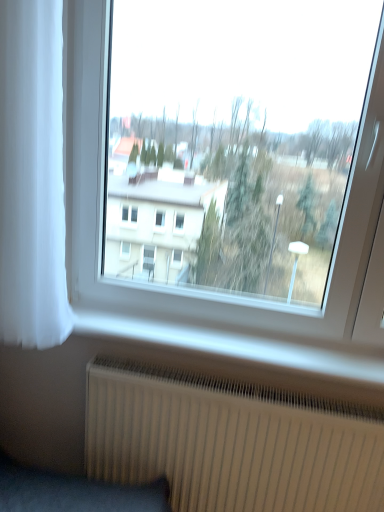
Question: Can you confirm if white sheer curtain at left is shorter than white ribbed radiator at lower center?

Choices:
 (A) no
 (B) yes

Answer: (A)

Question: From a real-world perspective, is white sheer curtain at left physically below white ribbed radiator at lower center?

Choices:
 (A) no
 (B) yes

Answer: (A)

Question: Is white ribbed radiator at lower center at the back of white sheer curtain at left?

Choices:
 (A) no
 (B) yes

Answer: (A)

Question: Is white sheer curtain at left oriented towards white ribbed radiator at lower center?

Choices:
 (A) yes
 (B) no

Answer: (B)

Question: Is white ribbed radiator at lower center a part of white sheer curtain at left?

Choices:
 (A) yes
 (B) no

Answer: (B)

Question: Considering their positions, is white sheer curtain at left located in front of or behind transparent glass window at center?

Choices:
 (A) behind
 (B) front

Answer: (B)

Question: From the image's perspective, is white sheer curtain at left located above or below transparent glass window at center?

Choices:
 (A) below
 (B) above

Answer: (B)

Question: Considering the positions of white sheer curtain at left and transparent glass window at center in the image, is white sheer curtain at left wider or thinner than transparent glass window at center?

Choices:
 (A) thin
 (B) wide

Answer: (B)

Question: Is white sheer curtain at left taller or shorter than transparent glass window at center?

Choices:
 (A) tall
 (B) short

Answer: (B)

Question: Would you say transparent glass window at center is to the left or to the right of white sheer curtain at left in the picture?

Choices:
 (A) left
 (B) right

Answer: (B)

Question: From the image's perspective, is transparent glass window at center above or below white sheer curtain at left?

Choices:
 (A) above
 (B) below

Answer: (B)

Question: In the image, is transparent glass window at center positioned in front of or behind white sheer curtain at left?

Choices:
 (A) behind
 (B) front

Answer: (A)

Question: In terms of width, does transparent glass window at center look wider or thinner when compared to white sheer curtain at left?

Choices:
 (A) thin
 (B) wide

Answer: (A)

Question: Looking at the image, does white ribbed radiator at lower center seem bigger or smaller compared to transparent glass window at center?

Choices:
 (A) small
 (B) big

Answer: (A)

Question: Do you think white ribbed radiator at lower center is within transparent glass window at center, or outside of it?

Choices:
 (A) outside
 (B) inside

Answer: (A)